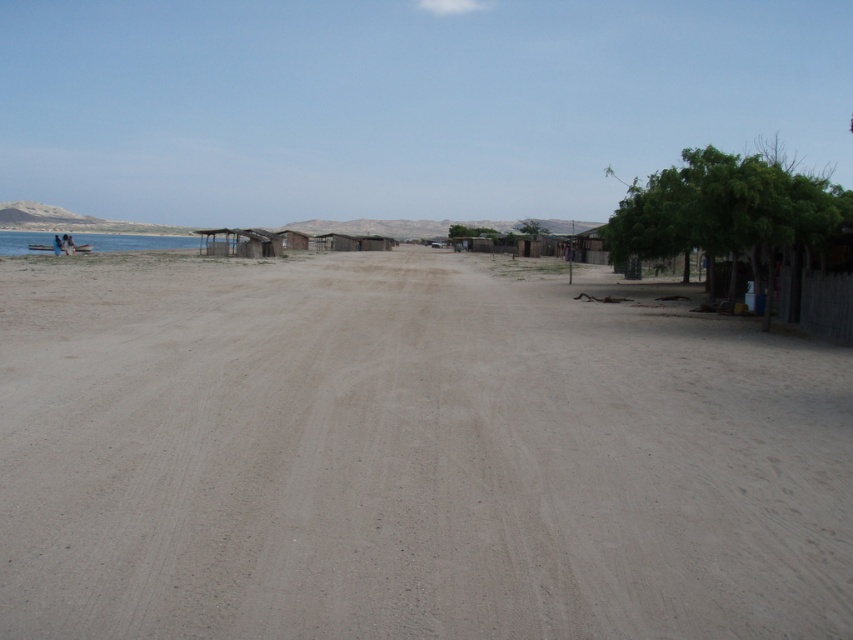
You are a traveler who needs to cross the dull brown dirt field at center and the blue water at left. Which area requires more time to cross based on their sizes?

The blue water at left is larger than the dull brown dirt field at center, so it would take more time to cross the blue water at left.

You are standing at the point marked as point [408,456] in the image. What color is the ground where you are standing?

The ground at point [408,456] is a dull brown dirt field.